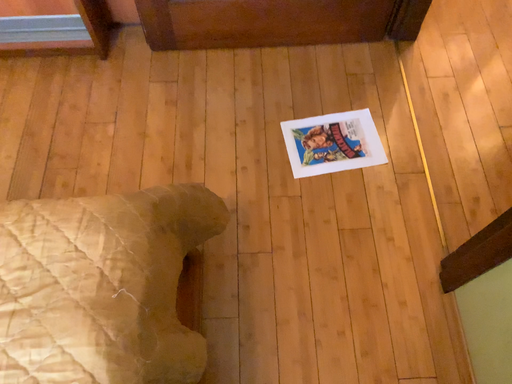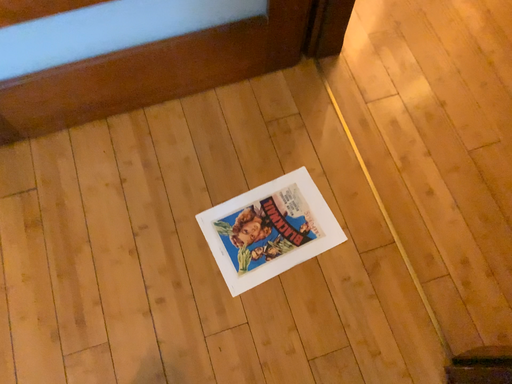
Question: How did the camera likely rotate when shooting the video?

Choices:
 (A) rotated left
 (B) rotated right

Answer: (B)